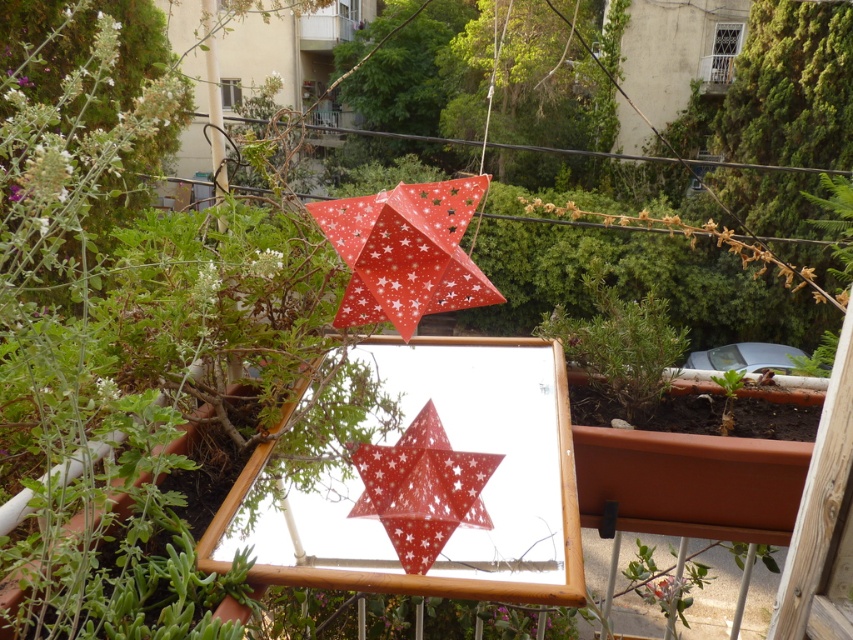
You are a painter standing 2 meters away from the wooden mirror. You want to paint both the red paper star at upper center and the green leafy plant at center. Can you reach both objects with your paintbrush without moving your position? Explain your reasoning.

The red paper star at upper center and green leafy plant at center are 1.00 meters apart. Since you are standing 2 meters away from the wooden mirror, the distance between you and each object would be within your reach if your paintbrush can extend at least 2 meters. However, the question does not specify the paintbrush length. Assuming standard paintbrushes cannot reach 2 meters, you would need to move closer. But based on the given information, the objects are 1 meter apart from each other, which doesn

You are standing on the balcony and want to take a photo of the red paper star at upper center and the green leafy plant at center. Which object will appear closer to the camera in the photo?

The red paper star at upper center will appear closer to the camera because it is in front of the green leafy plant at center.

You are standing on the balcony looking at the festive decorations. You see the red paper star at upper center and the green leafy plant at center. Which object is positioned to the left when viewed from your perspective?

The red paper star at upper center is to the left of the green leafy plant at center.